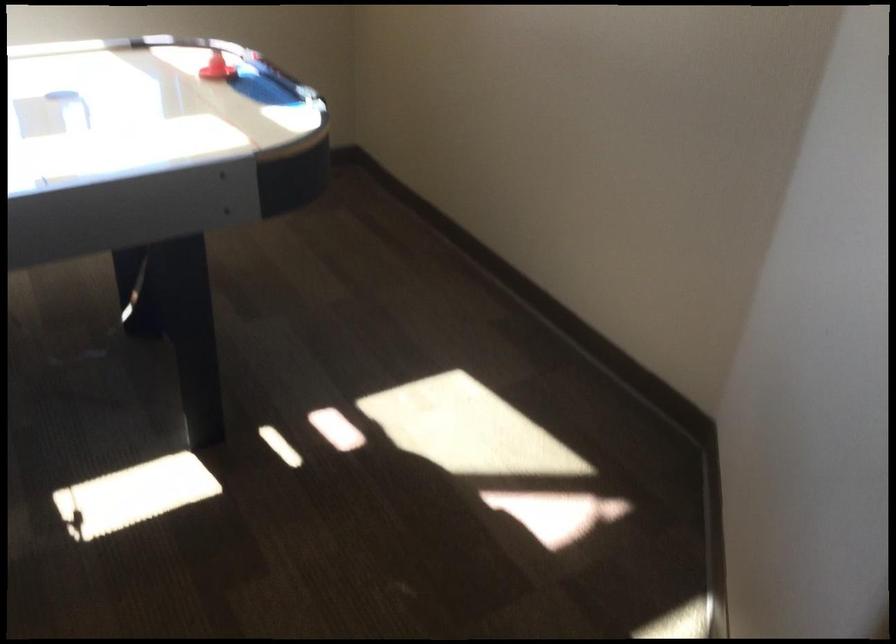
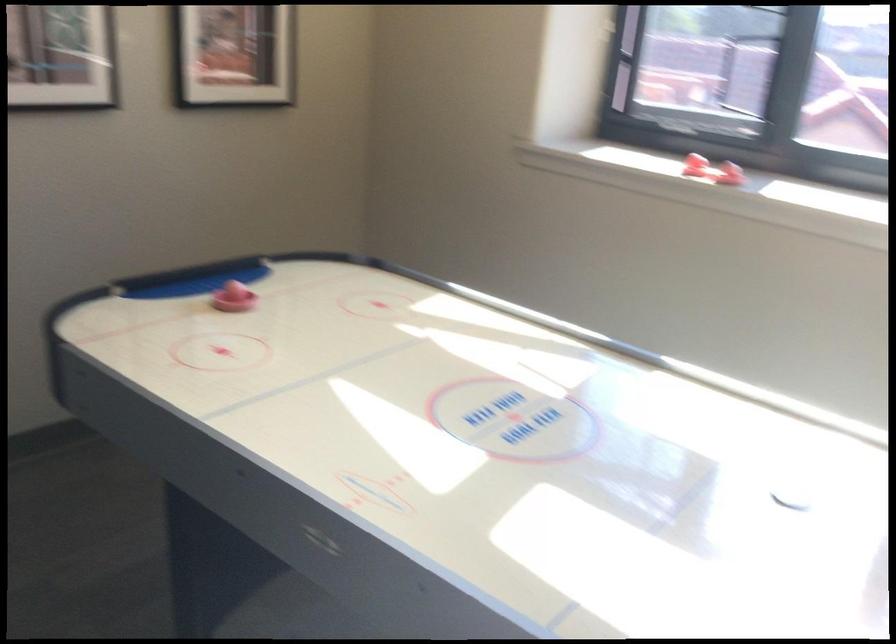
Question: The camera is either moving clockwise (left) or counter-clockwise (right) around the object. The first image is from the beginning of the video and the second image is from the end. Is the camera moving left or right when shooting the video?

Choices:
 (A) Left
 (B) Right

Answer: (B)